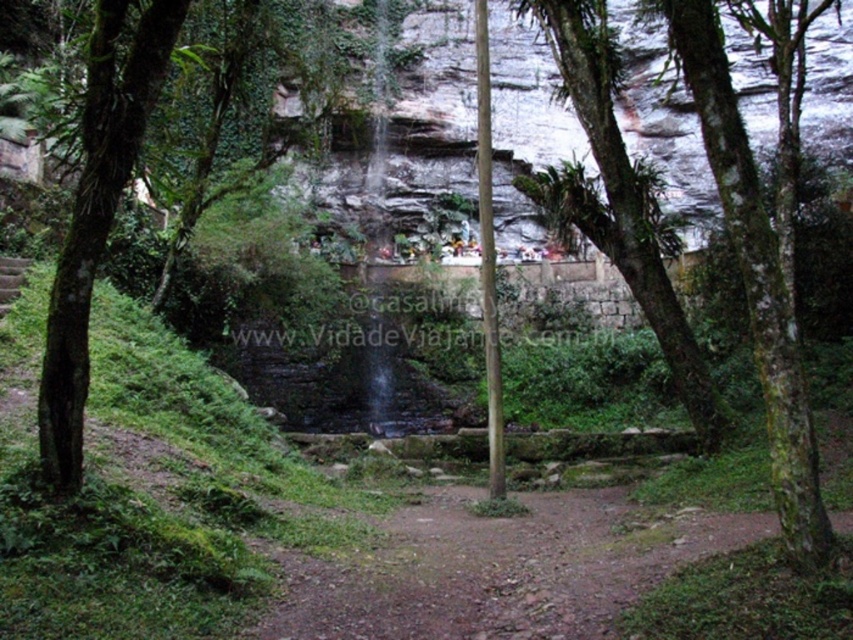
Is green mossy tree at center to the left of green rough bark tree at left from the viewer's perspective?

No, green mossy tree at center is not to the left of green rough bark tree at left.

Does green mossy tree at center have a larger size compared to green rough bark tree at left?

Yes.

Does point (613, 173) come farther from viewer compared to point (91, 193)?

Yes, point (613, 173) is farther from viewer.

Find the location of a particular element. Image resolution: width=853 pixels, height=640 pixels. green mossy tree at center is located at coordinates (618, 202).

Consider the image. Who is shorter, green rough bark tree at left or green mossy bark tree at center?

With less height is green rough bark tree at left.

Consider the image. Which is more to the right, green rough bark tree at left or green mossy bark tree at center?

green mossy bark tree at center

Which is in front, point (67, 456) or point (747, 179)?

Point (747, 179) is in front.

You are a GUI agent. You are given a task and a screenshot of the screen. Output one action in this format:
    pyautogui.click(x=<x>, y=<y>)
    Task: Click on the green rough bark tree at left
    
    Given the screenshot: What is the action you would take?
    pyautogui.click(x=96, y=216)

Locate an element on the screen. brown dirt path at center is located at coordinates (498, 568).

Is brown dirt path at center to the left of green mossy bark tree at center from the viewer's perspective?

Correct, you'll find brown dirt path at center to the left of green mossy bark tree at center.

Where is `brown dirt path at center`? Image resolution: width=853 pixels, height=640 pixels. brown dirt path at center is located at coordinates (498, 568).